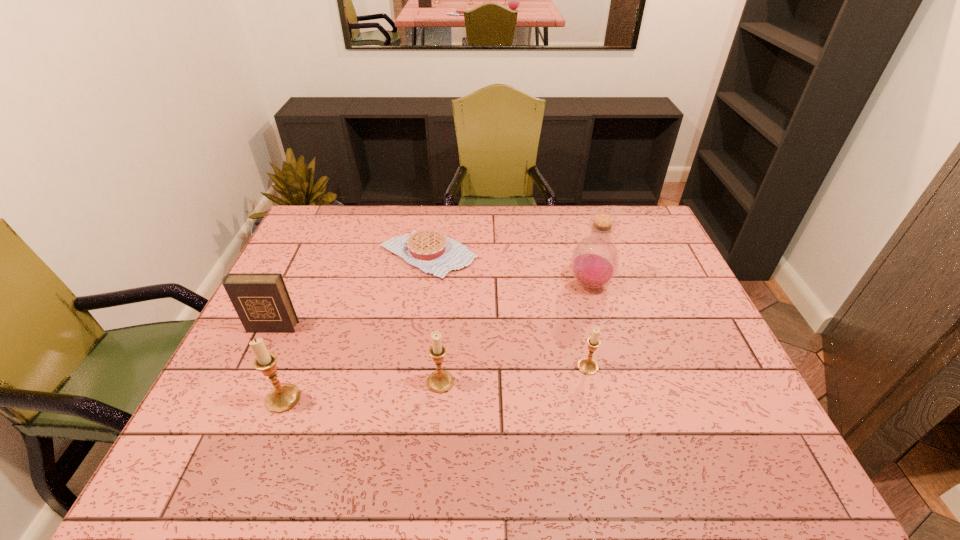
Find the location of a particular element. This screenshot has height=540, width=960. free spot located 0.250m on the right of the pie is located at coordinates (554, 255).

Find the location of `free space located 0.190m on the front cover of the fourth nearest object`. free space located 0.190m on the front cover of the fourth nearest object is located at coordinates (241, 393).

Find the location of a particular element. Image resolution: width=960 pixels, height=540 pixels. free space located 0.140m on the back of the bottle is located at coordinates (578, 243).

You are a GUI agent. You are given a task and a screenshot of the screen. Output one action in this format:
    pyautogui.click(x=<x>, y=<y>)
    Task: Click on the object at the far edge
    
    Given the screenshot: What is the action you would take?
    pyautogui.click(x=431, y=251)

Locate an element on the screen. object located in the near edge section of the desktop is located at coordinates (283, 397).

You are a GUI agent. You are given a task and a screenshot of the screen. Output one action in this format:
    pyautogui.click(x=<x>, y=<y>)
    Task: Click on the candle holder that is at the left edge
    The width and height of the screenshot is (960, 540).
    Given the screenshot: What is the action you would take?
    pyautogui.click(x=283, y=397)

Locate an element on the screen. diary located at the left edge is located at coordinates (261, 300).

Where is `object that is positioned at the near left corner`? object that is positioned at the near left corner is located at coordinates (283, 397).

You are a GUI agent. You are given a task and a screenshot of the screen. Output one action in this format:
    pyautogui.click(x=<x>, y=<y>)
    Task: Click on the vacant position at the far edge of the desktop
    This screenshot has height=540, width=960.
    Given the screenshot: What is the action you would take?
    pyautogui.click(x=457, y=226)

I want to click on blank area at the near edge, so click(x=675, y=404).